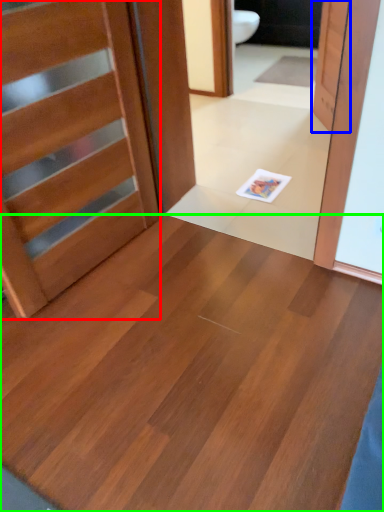
Question: Estimate the real-world distances between objects in this image. Which object is farther from door (highlighted by a red box), door (highlighted by a blue box) or plywood (highlighted by a green box)?

Choices:
 (A) door
 (B) plywood

Answer: (A)